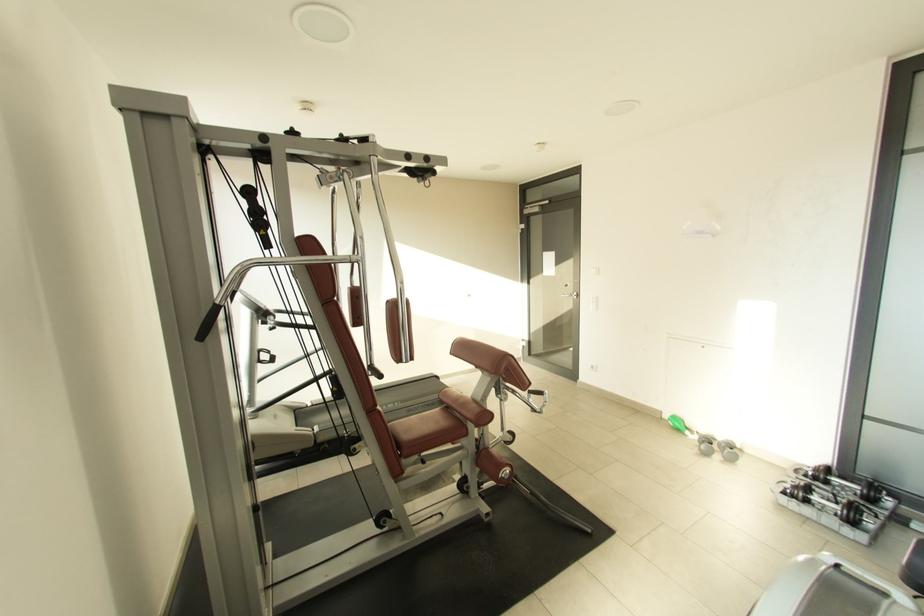
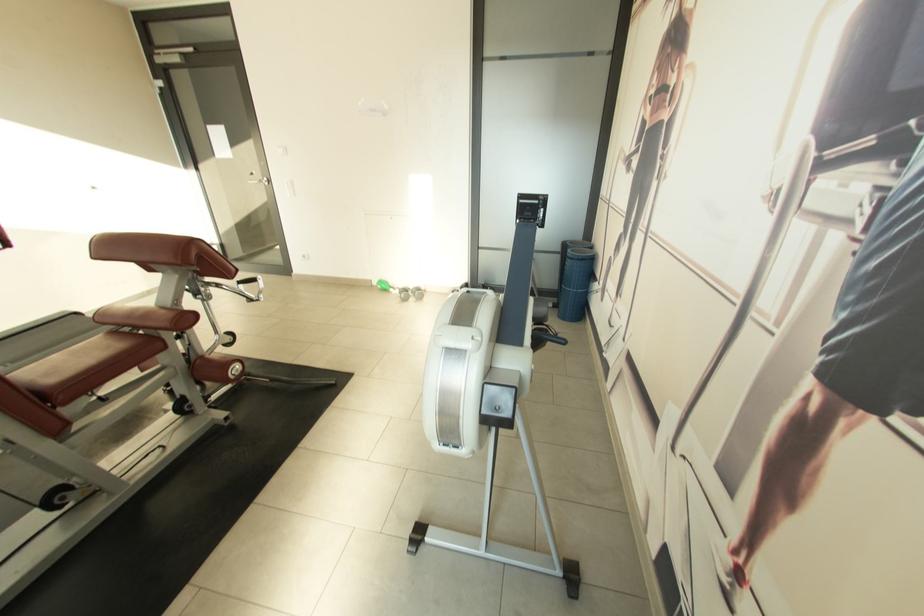
Where in the second image is the point corresponding to (572,286) from the first image?

(258, 175)